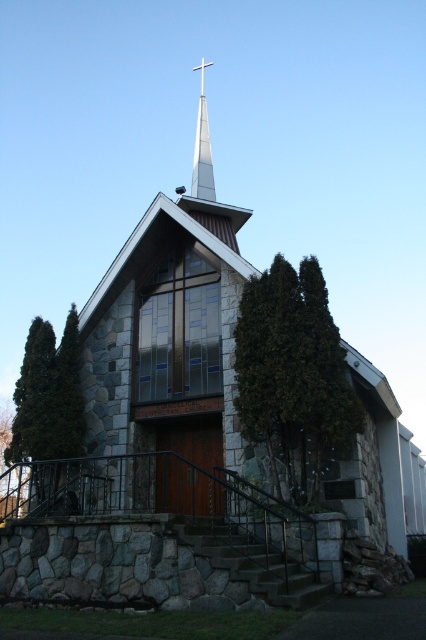
You are standing in front of the church and want to take a photo that includes both point (287, 301) and point (57, 435). Which point will appear larger in your photo?

Point (287, 301) is closer to the camera than point (57, 435), so it will appear larger in the photo.